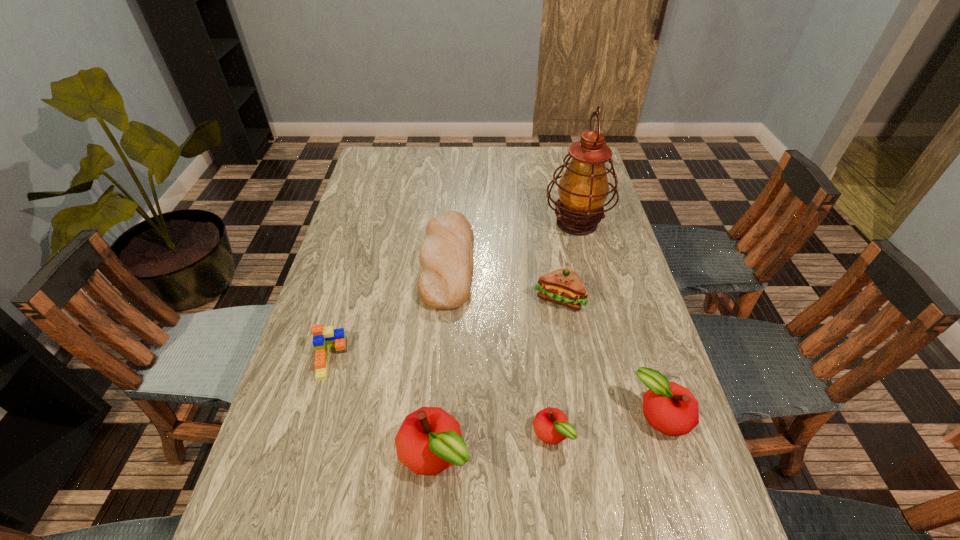
Please point a spot on the left to add another apple. Please provide its 2D coordinates. Your answer should be formatted as a tuple, i.e. [(x, y)], where the tuple contains the x and y coordinates of a point satisfying the conditions above.

[(308, 473)]